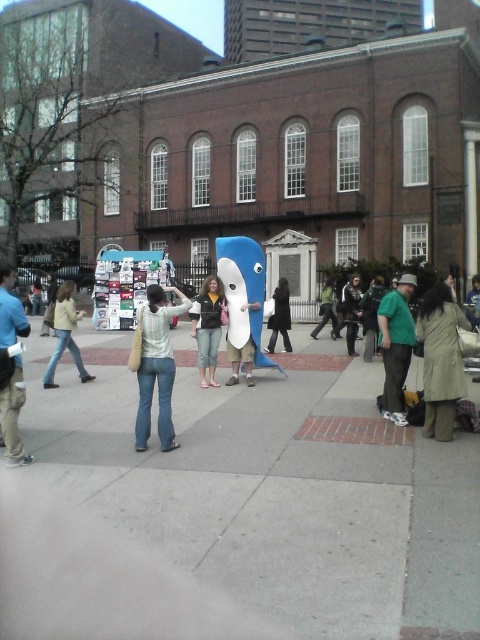
Can you confirm if gray concrete sidewalk at center is positioned to the right of white matte shark at center?

Yes, gray concrete sidewalk at center is to the right of white matte shark at center.

Is point (455, 561) closer to viewer compared to point (228, 310)?

Yes.

At what (x,y) coordinates should I click in order to perform the action: click on gray concrete sidewalk at center. Please return your answer as a coordinate pair (x, y). The width and height of the screenshot is (480, 640). Looking at the image, I should click on (274, 486).

Does light yellow jacket at left have a greater width compared to green fabric jacket at center?

Yes, light yellow jacket at left is wider than green fabric jacket at center.

Where is `light yellow jacket at left`? This screenshot has height=640, width=480. light yellow jacket at left is located at coordinates (64, 333).

Where is `light yellow jacket at left`? light yellow jacket at left is located at coordinates (64, 333).

Is khaki wool coat at lower right below denim jeans at center?

Yes, khaki wool coat at lower right is below denim jeans at center.

Is khaki wool coat at lower right to the left of denim jeans at center from the viewer's perspective?

No, khaki wool coat at lower right is not to the left of denim jeans at center.

Is point (439, 296) positioned after point (145, 432)?

That is True.

The height and width of the screenshot is (640, 480). I want to click on khaki wool coat at lower right, so click(x=441, y=358).